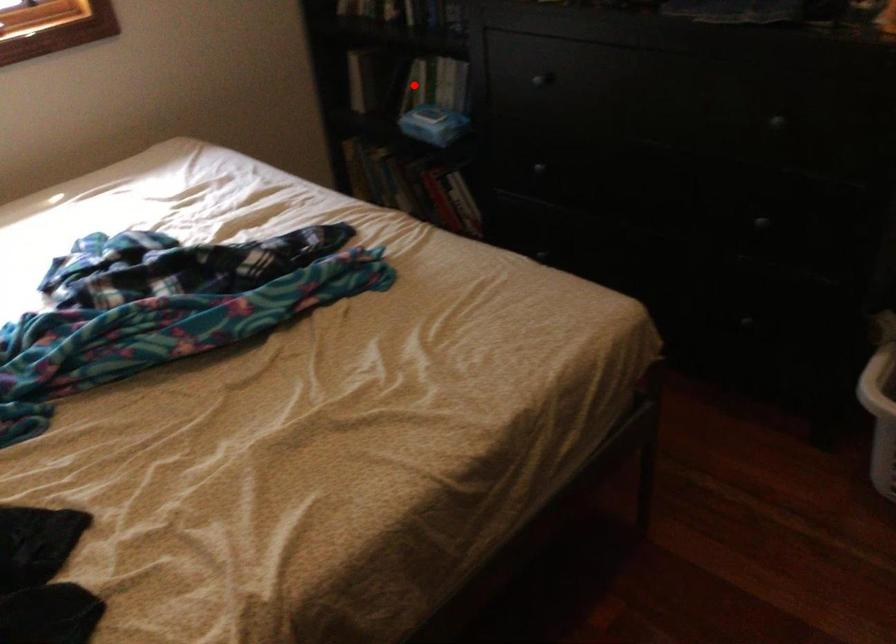
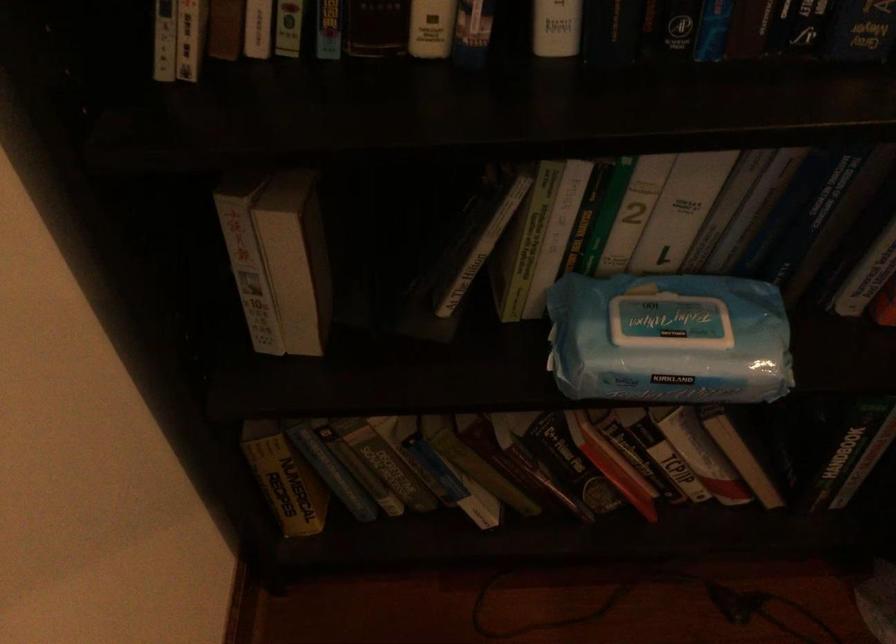
The point at the highlighted location is marked in the first image. Where is the corresponding point in the second image?

(522, 243)